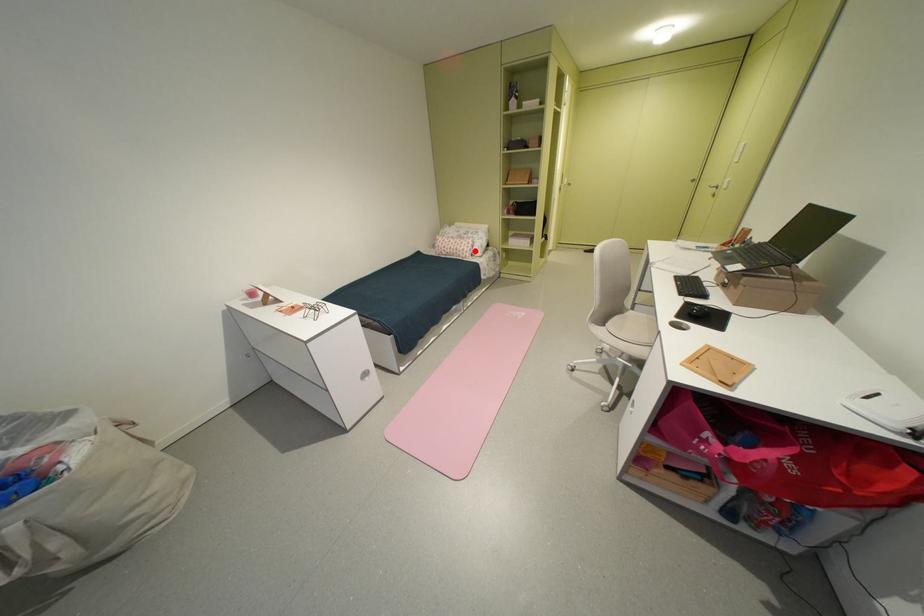
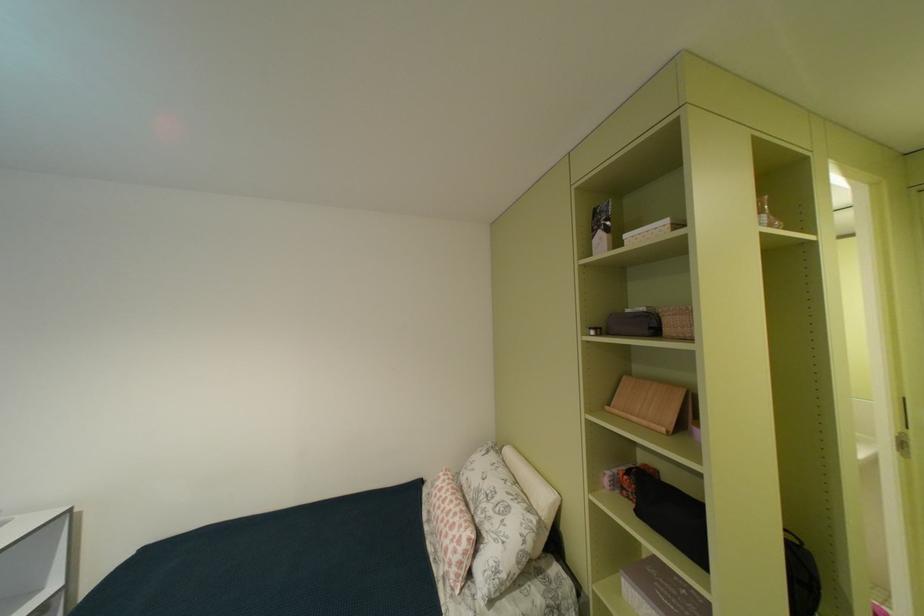
Question: I am providing you with two images of the same scene from different viewpoints. Image1 has a red point marked. In image2, the corresponding 3D location appears at what relative position? Reply with the corresponding letter.

Choices:
 (A) Closer
 (B) Farther

Answer: (B)